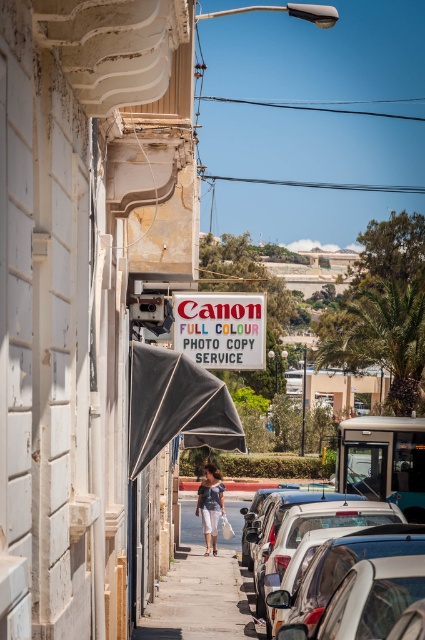
Question: Is white matte signboard at center wider than metallic silver car at center?

Choices:
 (A) no
 (B) yes

Answer: (B)

Question: In this image, where is white matte signboard at center located relative to gray concrete sidewalk at center?

Choices:
 (A) left
 (B) right

Answer: (A)

Question: Which point is farther from the camera taking this photo?

Choices:
 (A) (181, 576)
 (B) (210, 529)
 (C) (105, 499)

Answer: (B)

Question: Estimate the real-world distances between objects in this image. Which object is farther from the denim shorts at center?

Choices:
 (A) white matte signboard at center
 (B) gray concrete sidewalk at center

Answer: (A)

Question: Which point is farther to the camera?

Choices:
 (A) (115, 301)
 (B) (178, 636)
 (C) (218, 476)
 (D) (333, 548)

Answer: (C)

Question: Can you confirm if white matte signboard at center is positioned to the left of red plastic sign at center?

Choices:
 (A) yes
 (B) no

Answer: (A)